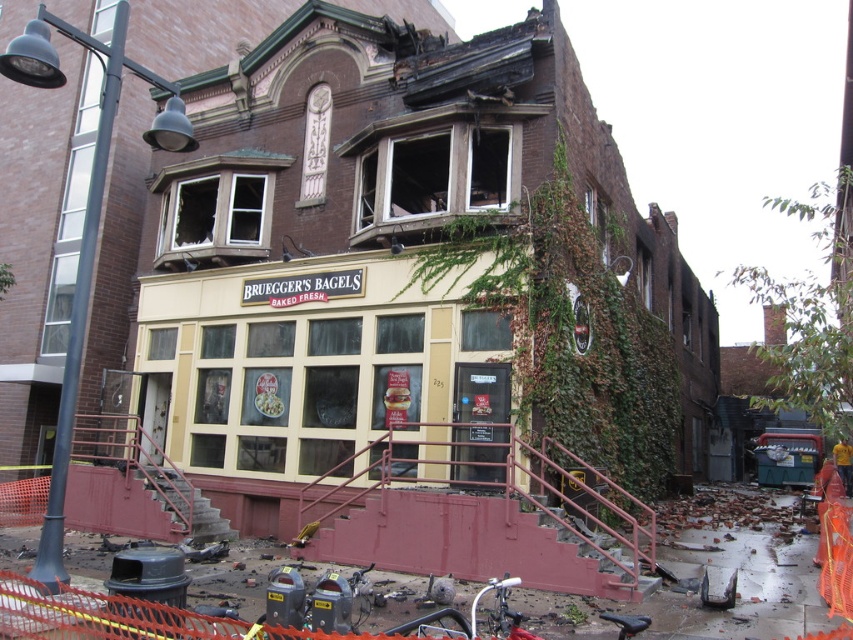
You are a maintenance worker who needs to reach the green ivy at center to trim it. The nearest ladder available is 15 meters long. Can you safely reach the ivy with the ladder?

The distance between you and the green ivy at center is 16.84 meters, which is longer than the 15 meter ladder. Therefore, the ladder is too short to safely reach the ivy.

You are a gardener assessing the ivy growth on the damaged building. Which of the two green ivy areas, the green ivy at center or the green ivy at upper right, is larger?

The green ivy at upper right is larger than the green ivy at center.